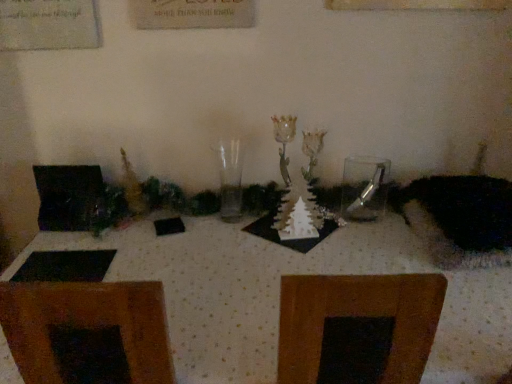
Question: Is point (238, 163) positioned closer to the camera than point (380, 165)?

Choices:
 (A) farther
 (B) closer

Answer: (A)

Question: Would you say transparent glass vase at center is inside or outside clear glass spoon at center?

Choices:
 (A) outside
 (B) inside

Answer: (A)

Question: Which object is positioned farthest from the transparent glass vase at center?

Choices:
 (A) white dotted fabric at center
 (B) clear glass spoon at center
 (C) fuzzy black cat at right

Answer: (C)

Question: Which object is the closest to the transparent glass vase at center?

Choices:
 (A) clear glass spoon at center
 (B) fuzzy black cat at right
 (C) white dotted fabric at center

Answer: (C)